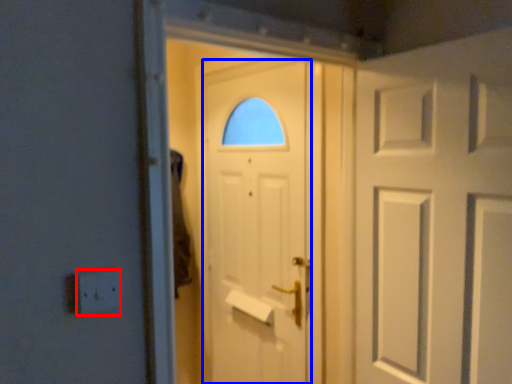
Question: Which object appears closest to the camera in this image, electric outlet (highlighted by a red box) or door (highlighted by a blue box)?

Choices:
 (A) electric outlet
 (B) door

Answer: (A)